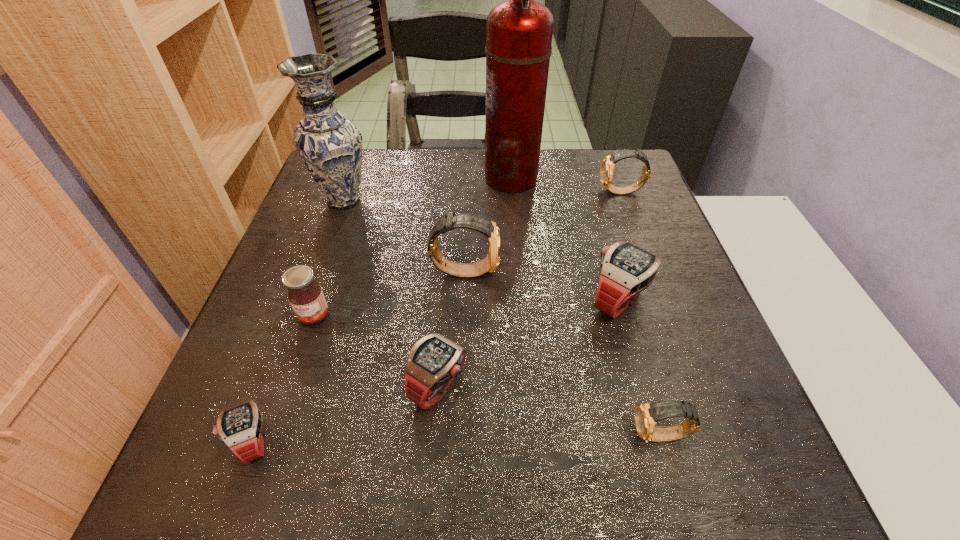
Identify the location of the closest gold watch to the tallest object. (606, 171).

Where is `gold watch object that ranks as the second closest to the second smallest red watch`? The image size is (960, 540). gold watch object that ranks as the second closest to the second smallest red watch is located at coordinates (647, 415).

Identify the location of red watch that is the closest one to the red fire extinguisher. (626, 269).

Point out which red watch is positioned as the nearest to the smallest gold watch. Please provide its 2D coordinates. Your answer should be formatted as a tuple, i.e. [(x, y)], where the tuple contains the x and y coordinates of a point satisfying the conditions above.

[(626, 269)]

Find the location of a particular element. The width and height of the screenshot is (960, 540). vacant space that satisfies the following two spatial constraints: 1. on the back side of the second smallest red watch; 2. on the right side of the shortest watch is located at coordinates (274, 386).

What are the coordinates of `free region that satisfies the following two spatial constraints: 1. on the side of the biggest red watch with the handle and hose; 2. on the left side of the tallest object` in the screenshot? It's located at (522, 301).

Find the location of a particular element. free point that satisfies the following two spatial constraints: 1. on the face of the rightmost red watch; 2. on the left side of the leftmost gold watch is located at coordinates (463, 301).

Find the location of a particular element. free space that satisfies the following two spatial constraints: 1. on the back side of the biggest red watch; 2. on the face of the tallest watch is located at coordinates pos(611,271).

Find the location of a particular element. This screenshot has width=960, height=540. vacant position in the image that satisfies the following two spatial constraints: 1. on the label side of the jam; 2. on the right side of the second smallest red watch is located at coordinates (291, 386).

Identify the location of free region that satisfies the following two spatial constraints: 1. on the back side of the biggest red watch; 2. on the face of the biggest gold watch. 611,271.